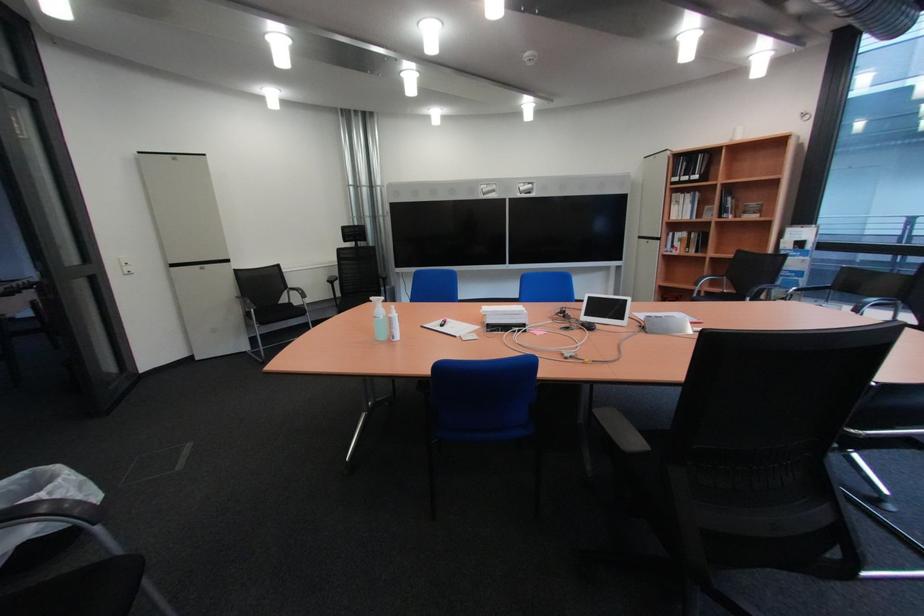
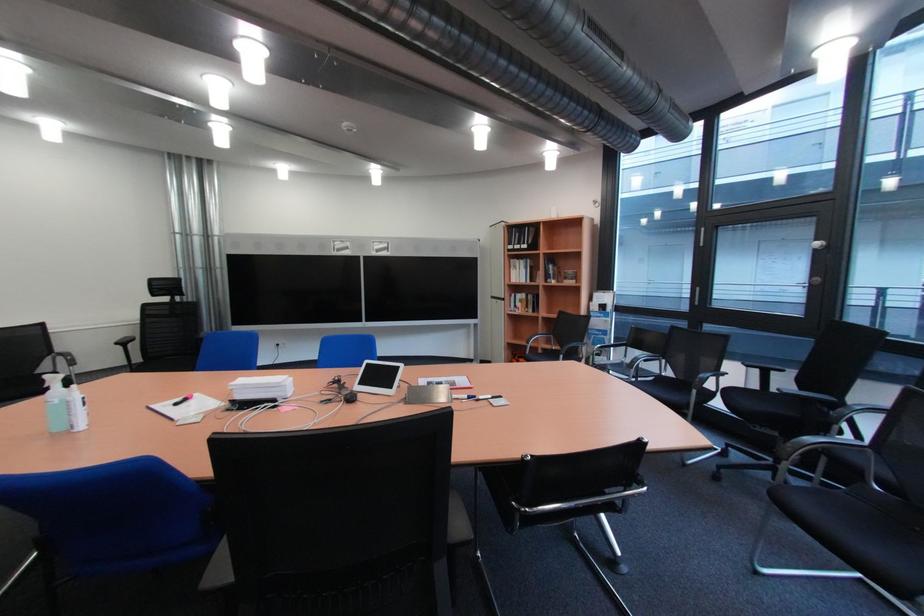
Question: What movement of the cameraman would produce the second image?

Choices:
 (A) Left
 (B) Right
 (C) Forward
 (D) Backward

Answer: (B)